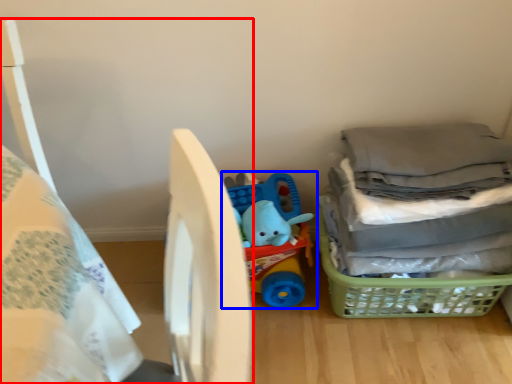
Question: Which object appears farthest to the camera in this image, bed (highlighted by a red box) or toy (highlighted by a blue box)?

Choices:
 (A) bed
 (B) toy

Answer: (B)